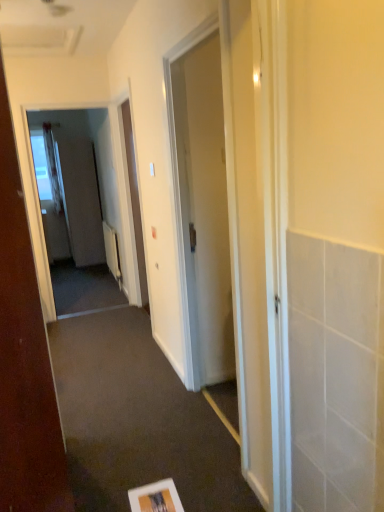
Question: Should I look upward or downward to see transparent glass screen door at left, which is the first screen door from right to left?

Choices:
 (A) up
 (B) down

Answer: (A)

Question: Is transparent glass screen door at left, which is the 2th screen door from left to right, wider than white sheer curtain at left?

Choices:
 (A) yes
 (B) no

Answer: (B)

Question: Is transparent glass screen door at left, the 1th screen door positioned from the front, at the right side of white sheer curtain at left?

Choices:
 (A) yes
 (B) no

Answer: (A)

Question: Does transparent glass screen door at left, which is the first screen door from right to left, have a lesser height compared to white sheer curtain at left?

Choices:
 (A) yes
 (B) no

Answer: (B)

Question: Is transparent glass screen door at left, marked as the second screen door in a back-to-front arrangement, not within white sheer curtain at left?

Choices:
 (A) yes
 (B) no

Answer: (A)

Question: Considering the relative sizes of transparent glass screen door at left, marked as the second screen door in a back-to-front arrangement, and white sheer curtain at left in the image provided, is transparent glass screen door at left, marked as the second screen door in a back-to-front arrangement, smaller than white sheer curtain at left?

Choices:
 (A) no
 (B) yes

Answer: (A)

Question: Is transparent glass screen door at left, the 1th screen door positioned from the front, oriented away from white sheer curtain at left?

Choices:
 (A) no
 (B) yes

Answer: (B)

Question: Is white glossy door at center, arranged as the 2th door when viewed from the front, in contact with white sheer curtain at left?

Choices:
 (A) no
 (B) yes

Answer: (A)

Question: From a real-world perspective, is white glossy door at center, the second door viewed from the left, over white sheer curtain at left?

Choices:
 (A) yes
 (B) no

Answer: (B)

Question: From a real-world perspective, is white glossy door at center, arranged as the 2th door when viewed from the front, located beneath white sheer curtain at left?

Choices:
 (A) no
 (B) yes

Answer: (B)

Question: Does white glossy door at center, acting as the 1th door starting from the right, lie behind white sheer curtain at left?

Choices:
 (A) no
 (B) yes

Answer: (A)

Question: Is the position of white glossy door at center, the second door viewed from the left, less distant than that of white sheer curtain at left?

Choices:
 (A) no
 (B) yes

Answer: (B)

Question: Can you confirm if white glossy door at center, the second door viewed from the left, is smaller than white sheer curtain at left?

Choices:
 (A) yes
 (B) no

Answer: (B)

Question: Can you confirm if white sheer curtain at left is wider than matte white screen door at left, the second screen door viewed from the front?

Choices:
 (A) no
 (B) yes

Answer: (A)